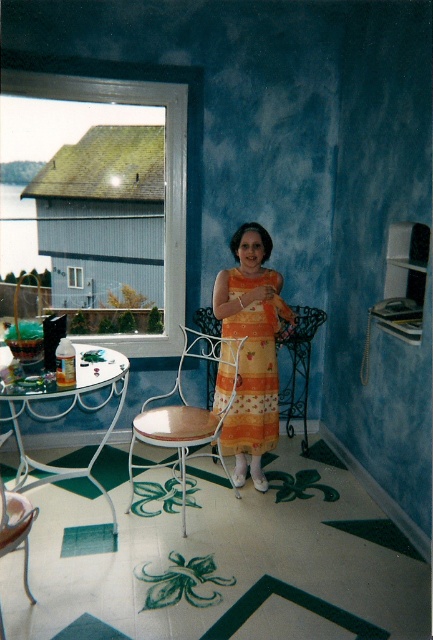
You are a guest at this vintage room and want to sit down. There is an orange printed fabric dress at center and a wooden seat at center. Which one should you sit on?

You should sit on the wooden seat at center because the orange printed fabric dress at center is much taller than the wooden seat at center, which means it is likely not a seating option.

You are a photographer setting up a shoot in this room. You need to position a small prop between the orange printed fabric dress at center and the wooden seat at center. Where should you place it to ensure it sits between them?

The orange printed fabric dress at center is above the wooden seat at center, so placing the prop on the wooden seat at center would position it below the dress, effectively between them.